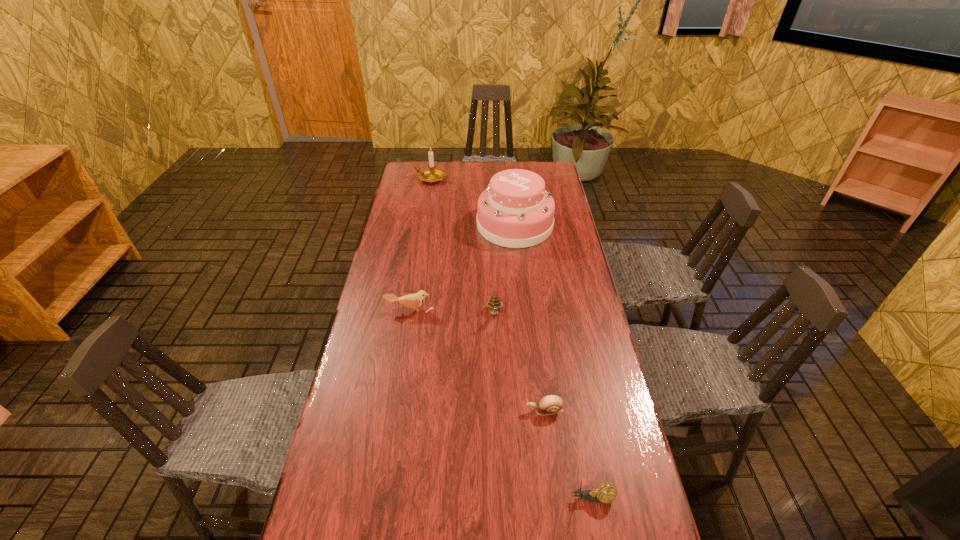
In order to click on free region located on the right of the fifth shortest object in this screenshot , I will do `click(507, 178)`.

This screenshot has height=540, width=960. I want to click on free point located on the face of the farthest escargot, so click(x=498, y=406).

This screenshot has height=540, width=960. I want to click on vacant space located 0.400m at the beak of the fourth tallest object, so click(x=390, y=429).

Where is `free region located on the front-facing side of the second nearest escargot`? free region located on the front-facing side of the second nearest escargot is located at coordinates (466, 410).

Locate an element on the screen. free space located 0.190m on the front-facing side of the second nearest escargot is located at coordinates (454, 410).

At what (x,y) coordinates should I click in order to perform the action: click on vacant space located on the front-facing side of the second nearest escargot. Please return your answer as a coordinate pair (x, y). Image resolution: width=960 pixels, height=540 pixels. Looking at the image, I should click on (435, 410).

Where is `vacant space situated on the front-facing side of the nearest object`? The height and width of the screenshot is (540, 960). vacant space situated on the front-facing side of the nearest object is located at coordinates (459, 498).

The image size is (960, 540). I want to click on vacant space situated 0.380m on the front-facing side of the nearest object, so click(x=402, y=498).

Where is `free spot located on the front-facing side of the nearest object`? free spot located on the front-facing side of the nearest object is located at coordinates (442, 498).

In order to click on object positioned at the far edge in this screenshot , I will do `click(431, 175)`.